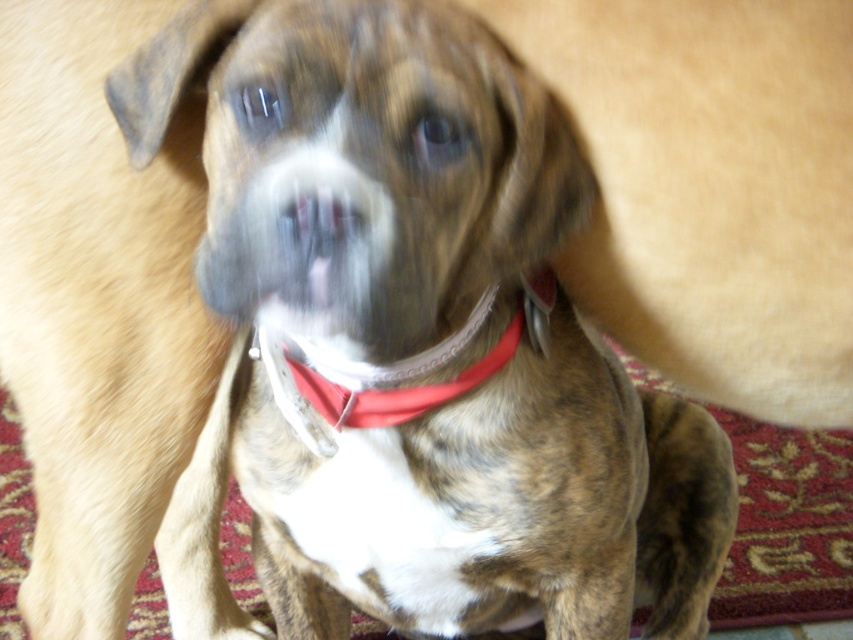
You are a photographer trying to capture a clear shot of the dog. You notice two points in the image labeled as point (494, 168) and point (318, 397). Which point should you focus on to ensure the dog is sharp in the photo?

You should focus on point (494, 168) because it is in front of point (318, 397), making it closer to the camera and thus more likely to be in focus for the dog.

You are a photographer trying to capture a clear shot of the brown fur dog at center and the red fabric neckband at center. Since the dog is moving, you decide to adjust your focus. Which object should you focus on first to ensure both are in the frame and clear?

The brown fur dog at center is positioned under the red fabric neckband at center, so you should focus on the red fabric neckband at center first to ensure both are in the frame and clear.

You are an AI analyzing the image. The image has a coordinate system where the bottom left corner is the origin point. The coordinates are given as a point between 0 and 1 in both x and y axes. Where is the brown fur dog at center located in the image?

The brown fur dog at center is located at the 2D coordinates point of (415, 340).